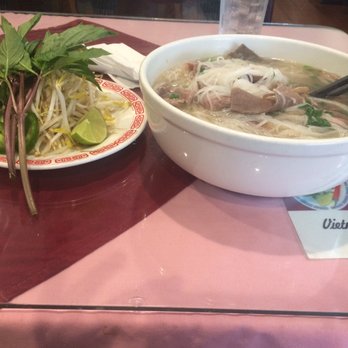
This screenshot has width=348, height=348. What are the coordinates of `white bowl` in the screenshot? It's located at (271, 176).